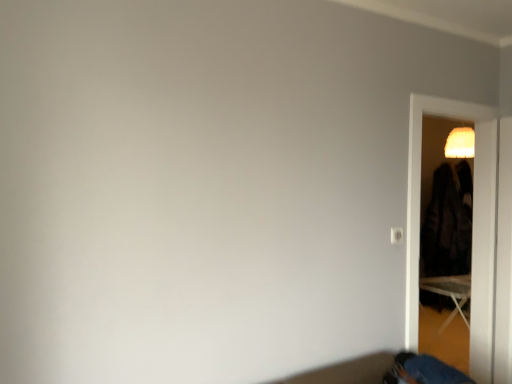
What are the coordinates of `matte black screen door at right` in the screenshot? It's located at (476, 217).

Describe the element at coordinates (476, 217) in the screenshot. I see `matte black screen door at right` at that location.

You are a GUI agent. You are given a task and a screenshot of the screen. Output one action in this format:
    pyautogui.click(x=<x>, y=<y>)
    Task: Click on the matte black screen door at right
    
    Given the screenshot: What is the action you would take?
    pyautogui.click(x=476, y=217)